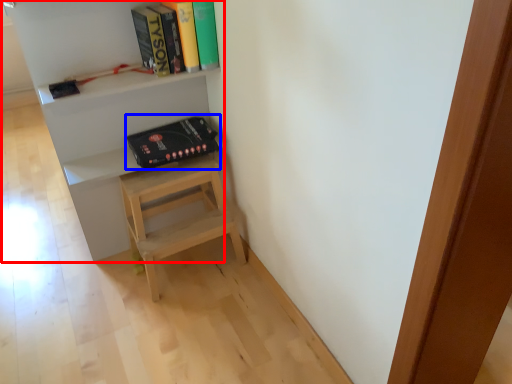
Question: Which object is closer to the camera taking this photo, shelf (highlighted by a red box) or paperback book (highlighted by a blue box)?

Choices:
 (A) shelf
 (B) paperback book

Answer: (A)